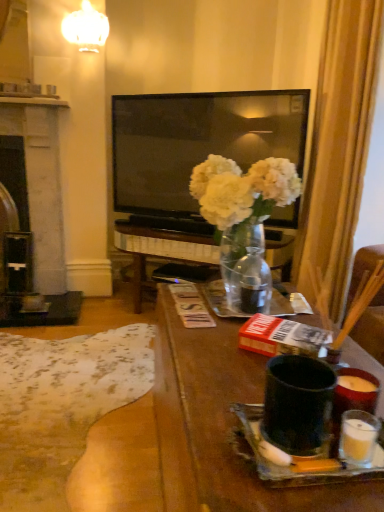
Question: Is translucent glass vase at center further to camera compared to black stone fireplace at left?

Choices:
 (A) yes
 (B) no

Answer: (B)

Question: Can you confirm if translucent glass vase at center is wider than black stone fireplace at left?

Choices:
 (A) yes
 (B) no

Answer: (B)

Question: From the image's perspective, is translucent glass vase at center located beneath black stone fireplace at left?

Choices:
 (A) yes
 (B) no

Answer: (A)

Question: Is translucent glass vase at center to the right of black stone fireplace at left from the viewer's perspective?

Choices:
 (A) no
 (B) yes

Answer: (B)

Question: Does translucent glass vase at center come in front of black stone fireplace at left?

Choices:
 (A) yes
 (B) no

Answer: (A)

Question: Is translucent glass vase at center not close to black stone fireplace at left?

Choices:
 (A) yes
 (B) no

Answer: (A)

Question: From a real-world perspective, is translucent glass vase at center below silky gold curtain at right?

Choices:
 (A) yes
 (B) no

Answer: (A)

Question: Can you confirm if translucent glass vase at center is taller than silky gold curtain at right?

Choices:
 (A) no
 (B) yes

Answer: (A)

Question: Does translucent glass vase at center contain silky gold curtain at right?

Choices:
 (A) no
 (B) yes

Answer: (A)

Question: Does translucent glass vase at center have a lesser height compared to silky gold curtain at right?

Choices:
 (A) no
 (B) yes

Answer: (B)

Question: Does translucent glass vase at center appear on the right side of silky gold curtain at right?

Choices:
 (A) no
 (B) yes

Answer: (A)

Question: From a real-world perspective, is translucent glass vase at center positioned over silky gold curtain at right based on gravity?

Choices:
 (A) no
 (B) yes

Answer: (A)

Question: Considering the relative positions of matte black mug at center and silky gold curtain at right in the image provided, is matte black mug at center to the left of silky gold curtain at right from the viewer's perspective?

Choices:
 (A) yes
 (B) no

Answer: (A)